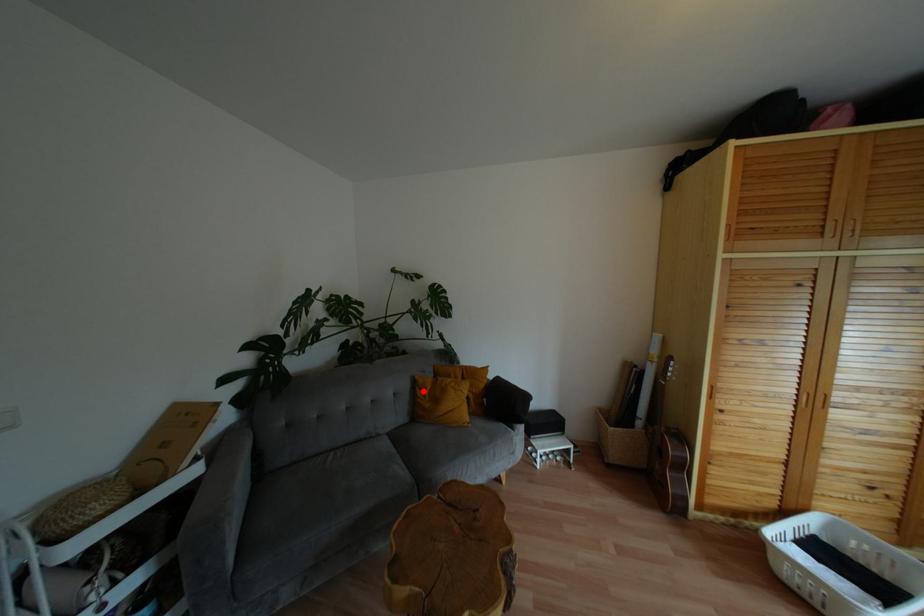
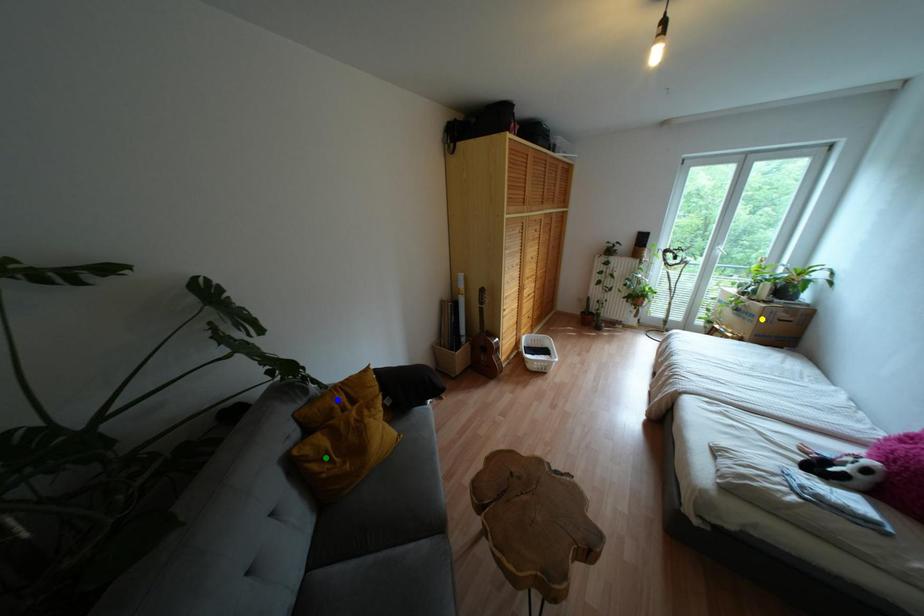
Question: I am providing you with two images of the same scene from different viewpoints. A red point is marked on the first image. You are given multiple points on the second image. In image 2, which mark is for the same physical point as the one in image 1?

Choices:
 (A) green point
 (B) yellow point
 (C) blue point

Answer: (A)